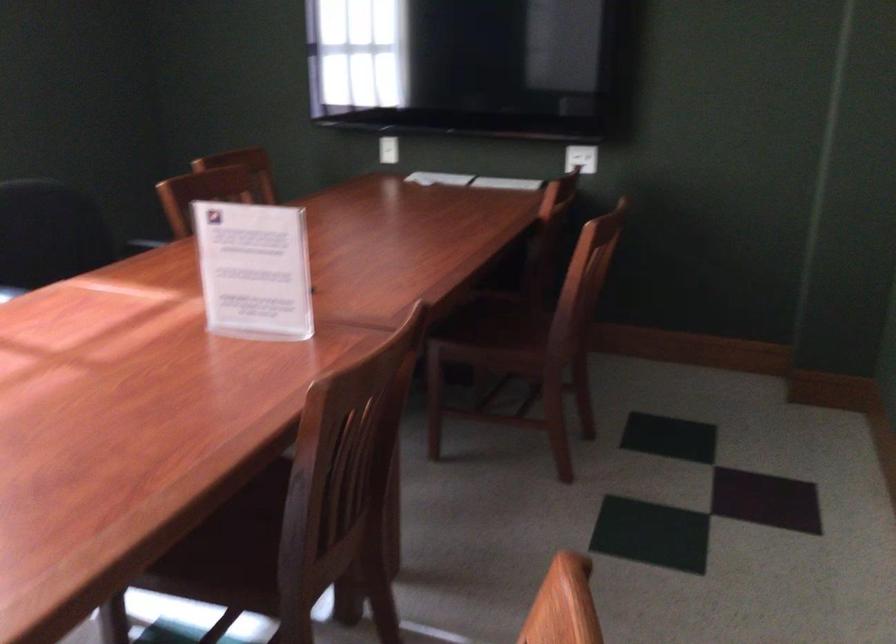
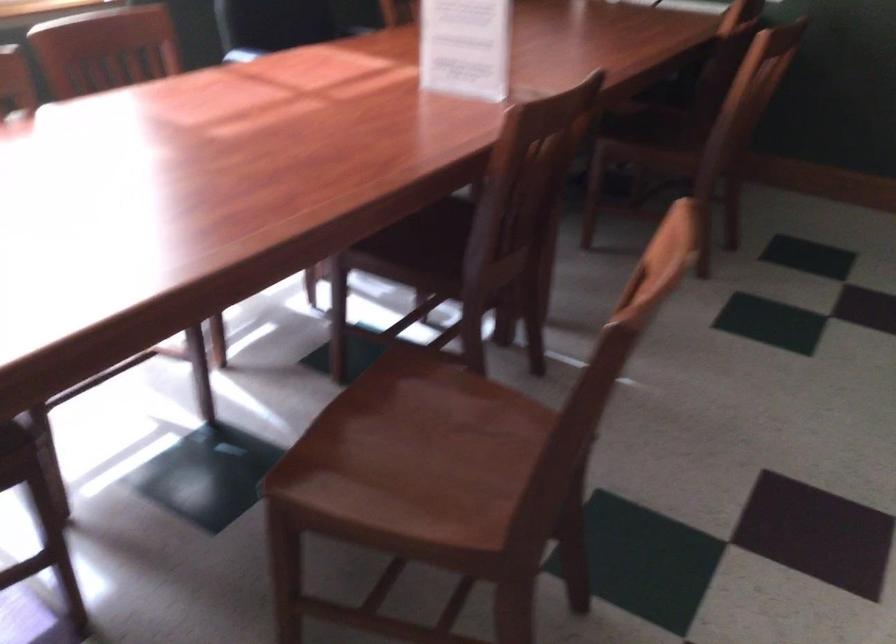
Find the pixel in the second image that matches point 220,545 in the first image.

(418, 247)